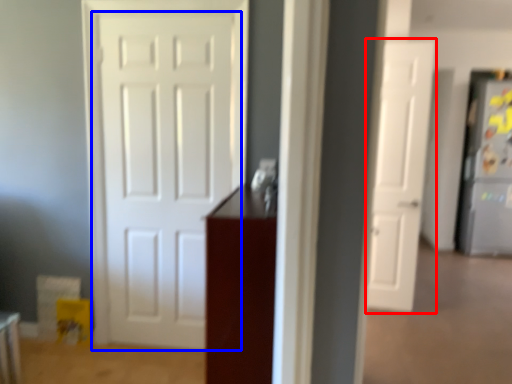
Question: Which object appears farthest to the camera in this image, door (highlighted by a red box) or door (highlighted by a blue box)?

Choices:
 (A) door
 (B) door

Answer: (A)